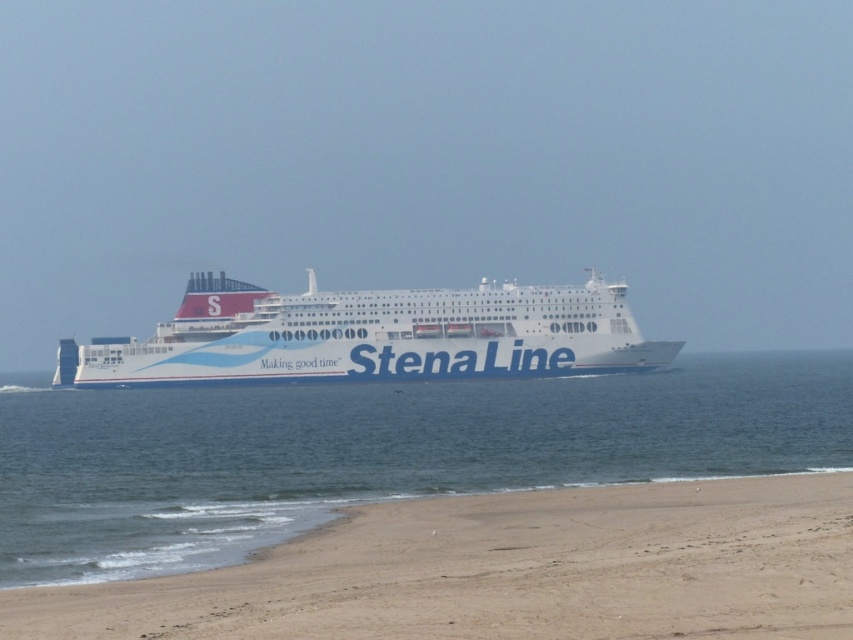
Question: Which of the following is the farthest from the observer?

Choices:
 (A) white glossy cruise ship at center
 (B) fine-grained sand at lower center

Answer: (A)

Question: Which object is farther from the camera taking this photo?

Choices:
 (A) white glossy cruise ship at center
 (B) fine-grained sand at lower center

Answer: (A)

Question: Is white water at center above white glossy cruise ship at center?

Choices:
 (A) no
 (B) yes

Answer: (A)

Question: Is fine-grained sand at lower center wider than white glossy cruise ship at center?

Choices:
 (A) yes
 (B) no

Answer: (B)

Question: Which point is farther to the camera?

Choices:
 (A) white water at center
 (B) white glossy cruise ship at center

Answer: (B)

Question: Does fine-grained sand at lower center lie in front of white glossy cruise ship at center?

Choices:
 (A) no
 (B) yes

Answer: (B)